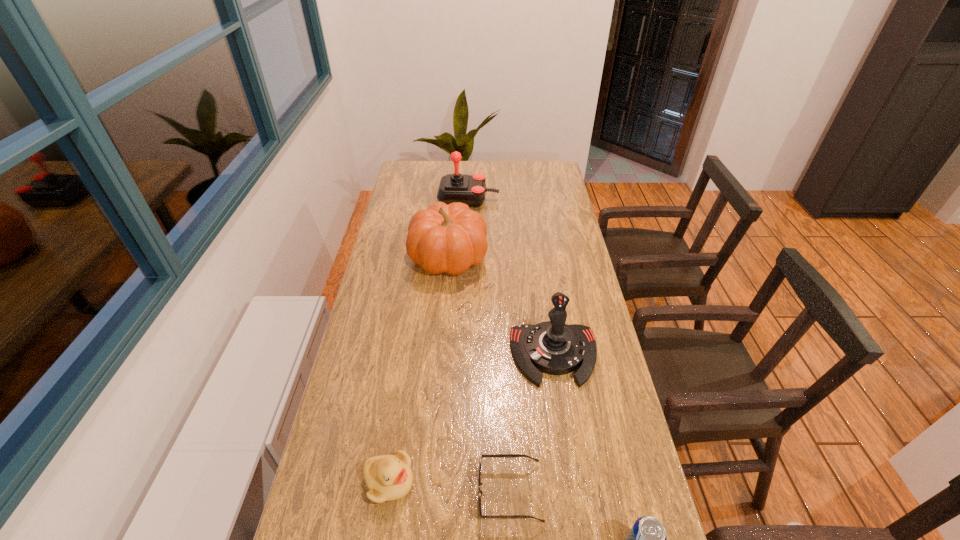
Where is `vacant area that lies between the fourth nearest object and the sunglasses`? The image size is (960, 540). vacant area that lies between the fourth nearest object and the sunglasses is located at coordinates (532, 423).

Where is `free space that is in between the shortest object and the farthest object`? The image size is (960, 540). free space that is in between the shortest object and the farthest object is located at coordinates (490, 346).

This screenshot has height=540, width=960. In order to click on free space between the duckling and the sunglasses in this screenshot , I will do `click(449, 487)`.

Locate an element on the screen. The image size is (960, 540). free spot between the sunglasses and the pumpkin is located at coordinates (479, 375).

Identify the location of vacant point located between the duckling and the fifth nearest object. Image resolution: width=960 pixels, height=540 pixels. click(419, 369).

Identify the location of vacant area between the third farthest object and the duckling. The image size is (960, 540). (471, 418).

Image resolution: width=960 pixels, height=540 pixels. In order to click on vacant point located between the third farthest object and the farthest object in this screenshot , I will do `click(512, 276)`.

I want to click on blank region between the pumpkin and the fifth tallest object, so click(419, 369).

Identify the location of vacant space that is in between the duckling and the fourth nearest object. (471, 418).

Choose which object is the nearest neighbor to the farther joystick. Please provide its 2D coordinates. Your answer should be formatted as a tuple, i.e. [(x, y)], where the tuple contains the x and y coordinates of a point satisfying the conditions above.

[(443, 238)]